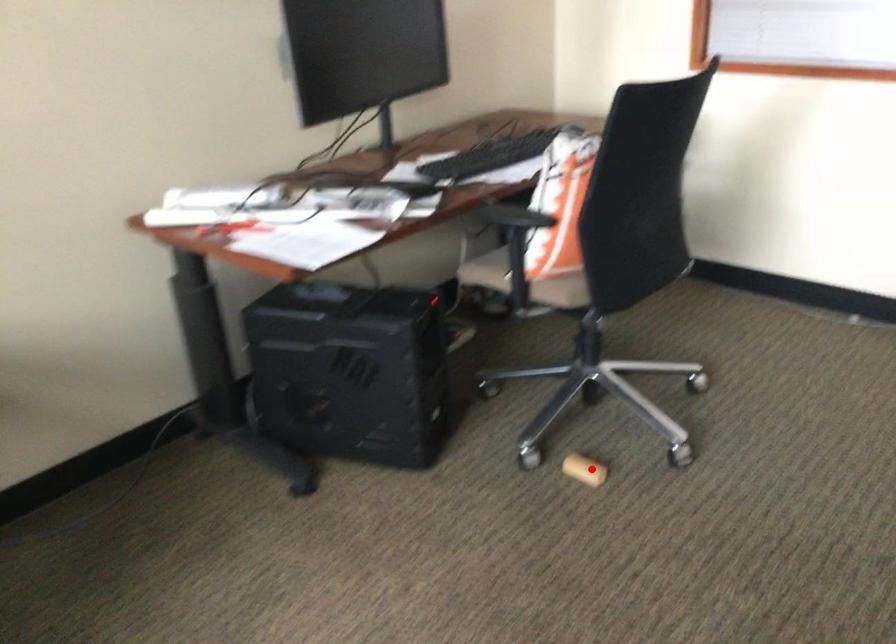
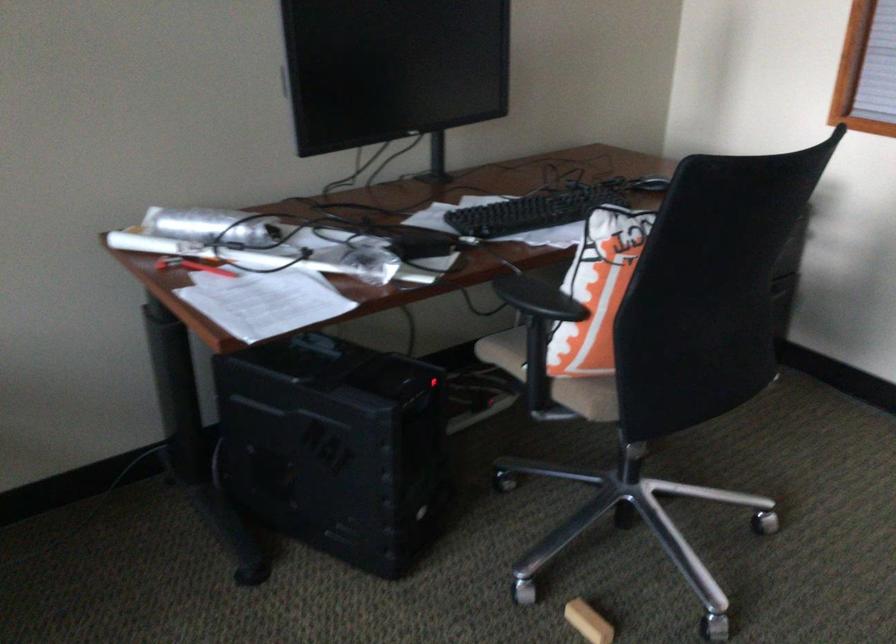
Question: I am providing you with two images of the same scene from different viewpoints. A red point is marked on the first image. Can you still see the location of the red point in image 2?

Choices:
 (A) Yes
 (B) No

Answer: (A)